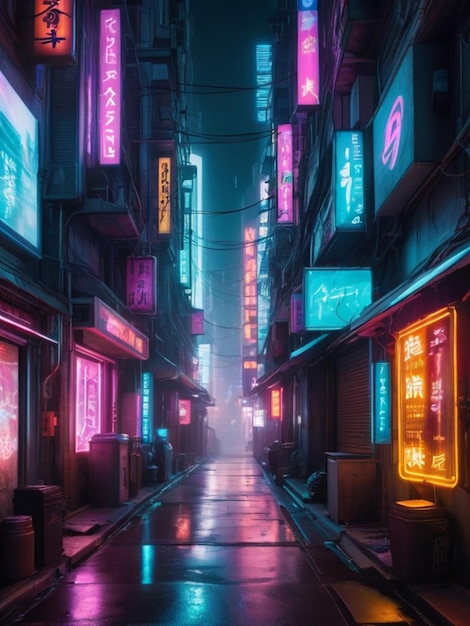
The height and width of the screenshot is (626, 470). Identify the location of bagged trash beside trash can. (311, 490).